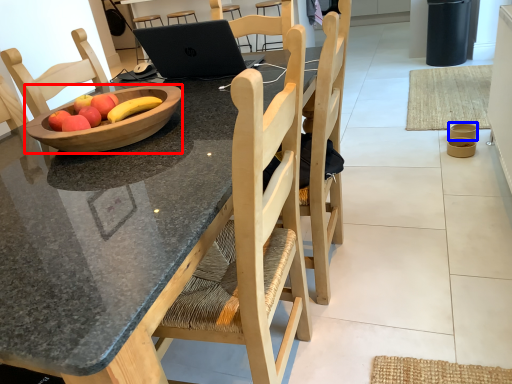
Question: Among these objects, which one is nearest to the camera, bowl (highlighted by a red box) or bowl (highlighted by a blue box)?

Choices:
 (A) bowl
 (B) bowl

Answer: (A)